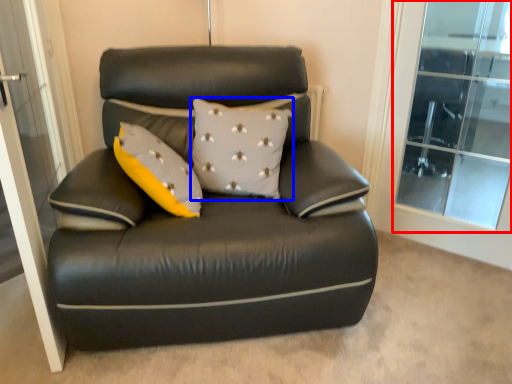
Question: Which object appears farthest to the camera in this image, window (highlighted by a red box) or pillow (highlighted by a blue box)?

Choices:
 (A) window
 (B) pillow

Answer: (A)